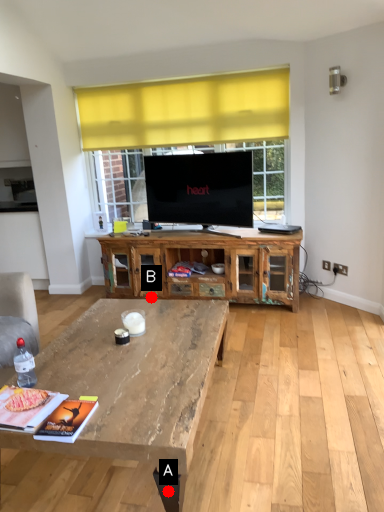
Question: Two points are circled on the image, labeled by A and B beside each circle. Which of the following is the farthest from the observer?

Choices:
 (A) A is further
 (B) B is further

Answer: (B)